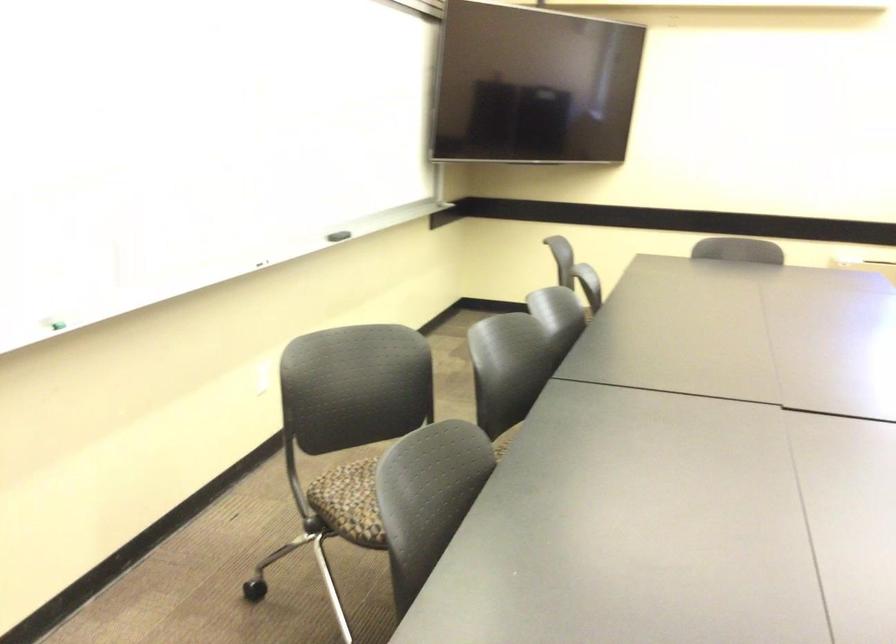
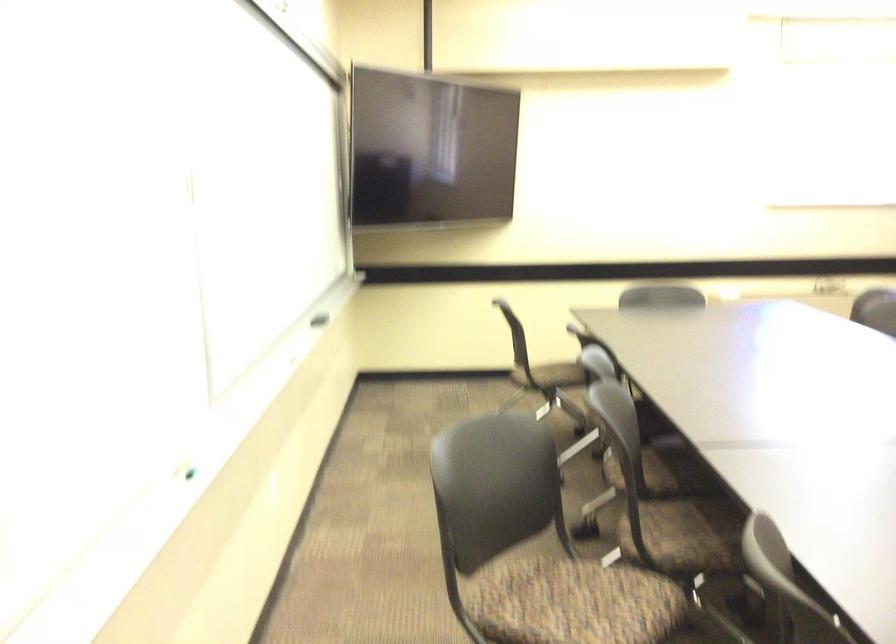
Question: How did the camera likely rotate?

Choices:
 (A) Left
 (B) Right
 (C) Up
 (D) Down

Answer: (B)